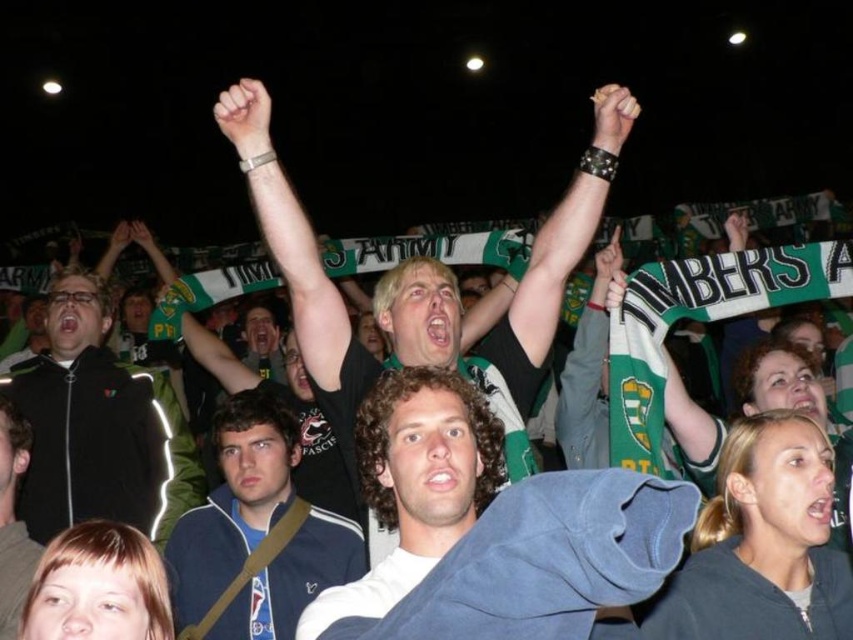
You are a photographer at the event and need to capture a photo of both the blue fabric jacket at center and the dark blue jacket at lower left. Considering their sizes, which jacket will appear wider in the photo?

The blue fabric jacket at center will appear wider in the photo because its width is larger than the dark blue jacket at lower left.

You are a photographer at the event and want to capture a photo that includes both the blue fabric jacket at center and the dark blue jacket at lower left. Which jacket should you position closer to the front of the frame to ensure both are fully visible?

The blue fabric jacket at center is taller than the dark blue jacket at lower left, so positioning the dark blue jacket at lower left closer to the front of the frame will ensure both are fully visible.